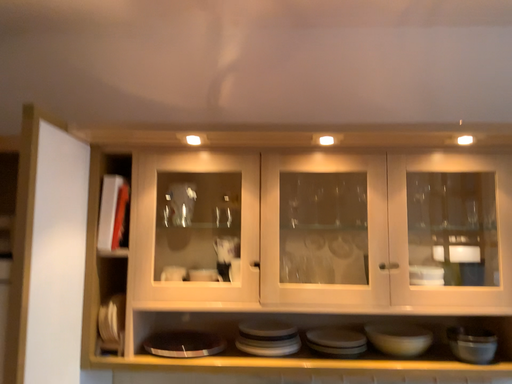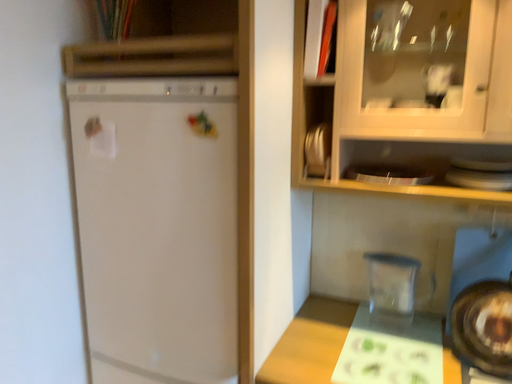
Question: How did the camera likely rotate when shooting the video?

Choices:
 (A) rotated upward
 (B) rotated downward

Answer: (B)